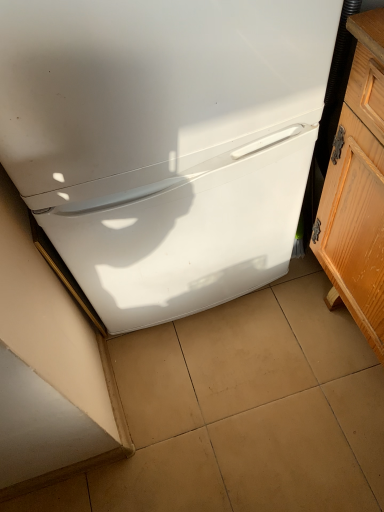
Identify the location of white glossy refrigerator at center. This screenshot has height=512, width=384. (164, 141).

Image resolution: width=384 pixels, height=512 pixels. What do you see at coordinates (164, 141) in the screenshot? I see `white glossy refrigerator at center` at bounding box center [164, 141].

Image resolution: width=384 pixels, height=512 pixels. In order to click on beige tile at center in this screenshot , I will do `click(251, 408)`.

Measure the distance between wooden cabinet at right and camera.

wooden cabinet at right and camera are 24.42 inches apart from each other.

What are the coordinates of `white glossy refrigerator at center` in the screenshot? It's located at (164, 141).

Is beige tile at center at the back of white glossy refrigerator at center?

That's not correct — white glossy refrigerator at center is not looking away from beige tile at center.

In the image, is white glossy refrigerator at center positioned in front of or behind beige tile at center?

In the image, white glossy refrigerator at center appears in front of beige tile at center.

Can you confirm if white glossy refrigerator at center is bigger than beige tile at center?

Indeed, white glossy refrigerator at center has a larger size compared to beige tile at center.

Identify the location of tile on the right of white glossy refrigerator at center. (251, 408).

Based on the photo, is wooden cabinet at right taller or shorter than white glossy refrigerator at center?

Clearly, wooden cabinet at right is shorter compared to white glossy refrigerator at center.

Would you consider wooden cabinet at right to be distant from white glossy refrigerator at center?

They are positioned close to each other.

Is the position of beige tile at center more distant than that of wooden cabinet at right?

That is True.

Considering the sizes of objects beige tile at center and wooden cabinet at right in the image provided, who is bigger, beige tile at center or wooden cabinet at right?

With larger size is wooden cabinet at right.

Is beige tile at center placed right next to wooden cabinet at right?

No, beige tile at center is not touching wooden cabinet at right.

From the image's perspective, which object appears higher, beige tile at center or white glossy refrigerator at center?

white glossy refrigerator at center is shown above in the image.

Is point (181, 502) positioned in front of point (77, 280)?

Yes, point (181, 502) is closer to viewer.

Does beige tile at center appear on the left side of white glossy refrigerator at center?

In fact, beige tile at center is to the right of white glossy refrigerator at center.

Would you say beige tile at center is inside or outside white glossy refrigerator at center?

beige tile at center is not enclosed by white glossy refrigerator at center.

Can you confirm if white glossy refrigerator at center is positioned to the right of wooden cabinet at right?

No.

How different are the orientations of white glossy refrigerator at center and wooden cabinet at right in degrees?

90 degrees.

Does point (3, 124) appear closer or farther from the camera than point (377, 61)?

Point (3, 124) appears to be closer to the viewer than point (377, 61).

From a real-world perspective, which object stands above the other?

white glossy refrigerator at center, from a real-world perspective.

Considering the points (376, 55) and (233, 505), which point is behind, point (376, 55) or point (233, 505)?

Point (233, 505)

From the image's perspective, which one is positioned higher, wooden cabinet at right or beige tile at center?

wooden cabinet at right is shown above in the image.

Can you confirm if wooden cabinet at right is positioned to the right of beige tile at center?

Indeed, wooden cabinet at right is positioned on the right side of beige tile at center.

Is wooden cabinet at right next to beige tile at center?

No, wooden cabinet at right is not beside beige tile at center.

What are the coordinates of `refrigerator lying on the left of beige tile at center` in the screenshot? It's located at (164, 141).

Where is `cabinetry in front of the white glossy refrigerator at center`? cabinetry in front of the white glossy refrigerator at center is located at coordinates (357, 189).

Which object lies further to the anchor point beige tile at center, wooden cabinet at right or white glossy refrigerator at center?

Based on the image, white glossy refrigerator at center appears to be further to beige tile at center.

Based on their spatial positions, is beige tile at center or white glossy refrigerator at center further from wooden cabinet at right?

beige tile at center is further to wooden cabinet at right.

Looking at the image, which one is located closer to wooden cabinet at right, white glossy refrigerator at center or beige tile at center?

The object closer to wooden cabinet at right is white glossy refrigerator at center.

From the picture: Looking at the image, which one is located further to beige tile at center, white glossy refrigerator at center or wooden cabinet at right?

Based on the image, white glossy refrigerator at center appears to be further to beige tile at center.

Which object lies further to the anchor point white glossy refrigerator at center, beige tile at center or wooden cabinet at right?

beige tile at center is further to white glossy refrigerator at center.

Which object lies further to the anchor point white glossy refrigerator at center, wooden cabinet at right or beige tile at center?

The object further to white glossy refrigerator at center is beige tile at center.

The image size is (384, 512). What are the coordinates of `cabinetry between white glossy refrigerator at center and beige tile at center from top to bottom` in the screenshot? It's located at (357, 189).